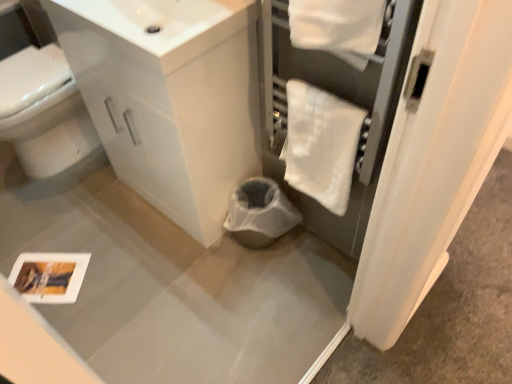
Question: Should I look upward or downward to see white fluffy bath towel at upper right?

Choices:
 (A) down
 (B) up

Answer: (B)

Question: From the image's perspective, is white glossy bidet at left on top of white glossy sink at upper center?

Choices:
 (A) no
 (B) yes

Answer: (A)

Question: Can you confirm if white glossy bidet at left is taller than white glossy sink at upper center?

Choices:
 (A) no
 (B) yes

Answer: (B)

Question: Is white glossy bidet at left closer to the viewer compared to white glossy sink at upper center?

Choices:
 (A) yes
 (B) no

Answer: (B)

Question: Is white glossy bidet at left to the left of white glossy sink at upper center from the viewer's perspective?

Choices:
 (A) yes
 (B) no

Answer: (A)

Question: Is white glossy bidet at left bigger than white glossy sink at upper center?

Choices:
 (A) no
 (B) yes

Answer: (B)

Question: Is white glossy bidet at left wider than white glossy sink at upper center?

Choices:
 (A) no
 (B) yes

Answer: (B)

Question: Is white glossy sink at upper center thinner than white glossy bidet at left?

Choices:
 (A) no
 (B) yes

Answer: (B)

Question: Considering the relative sizes of white glossy sink at upper center and white glossy bidet at left in the image provided, is white glossy sink at upper center smaller than white glossy bidet at left?

Choices:
 (A) yes
 (B) no

Answer: (A)

Question: From the image's perspective, is white glossy sink at upper center over white glossy bidet at left?

Choices:
 (A) yes
 (B) no

Answer: (A)

Question: Is white glossy sink at upper center to the right of white glossy bidet at left from the viewer's perspective?

Choices:
 (A) yes
 (B) no

Answer: (A)

Question: From a real-world perspective, is white glossy sink at upper center physically above white glossy bidet at left?

Choices:
 (A) yes
 (B) no

Answer: (A)

Question: Is white glossy sink at upper center oriented towards white glossy bidet at left?

Choices:
 (A) yes
 (B) no

Answer: (B)

Question: Would you say white fluffy bath towel at upper right is part of white glossy bidet at left's contents?

Choices:
 (A) no
 (B) yes

Answer: (A)